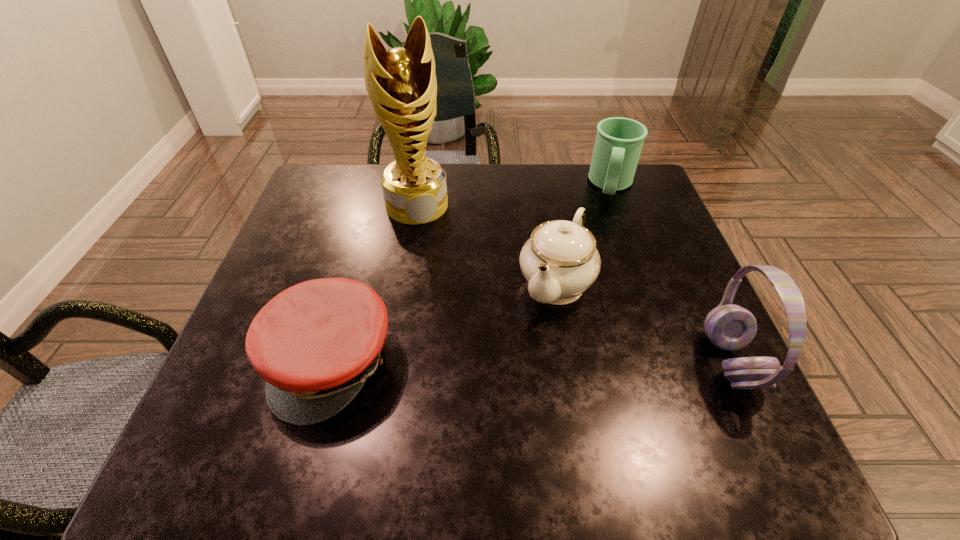
Where is `headset that is at the near edge`? Image resolution: width=960 pixels, height=540 pixels. headset that is at the near edge is located at coordinates (730, 327).

Where is `object that is positioned at the left edge`? This screenshot has height=540, width=960. object that is positioned at the left edge is located at coordinates (316, 343).

Identify the location of headset that is at the right edge. [x=730, y=327].

Locate an element on the screen. mug situated at the right edge is located at coordinates (619, 141).

Image resolution: width=960 pixels, height=540 pixels. Identify the location of object that is positioned at the near left corner. (316, 343).

The image size is (960, 540). In order to click on object that is at the far right corner in this screenshot , I will do `click(619, 141)`.

The height and width of the screenshot is (540, 960). Identify the location of object present at the near right corner. (730, 327).

Locate an element on the screen. vacant space at the far edge of the desktop is located at coordinates [x=564, y=177].

At what (x,y) coordinates should I click in order to perform the action: click on vacant space at the near edge of the desktop. Please return your answer as a coordinate pair (x, y). This screenshot has width=960, height=540. Looking at the image, I should click on (423, 382).

The height and width of the screenshot is (540, 960). I want to click on vacant area at the left edge, so click(237, 352).